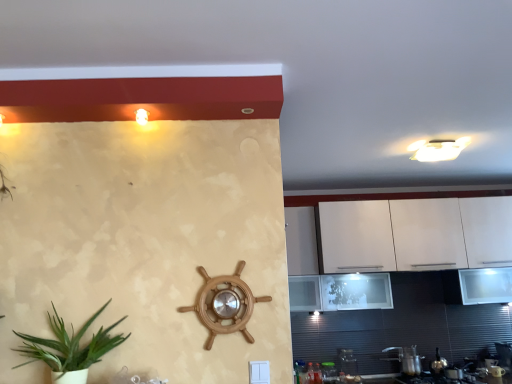
The image size is (512, 384). What do you see at coordinates (504, 354) in the screenshot?
I see `metallic silver kettle at lower right, the first appliance viewed from the right` at bounding box center [504, 354].

Locate an element on the screen. white glossy cabinet at right is located at coordinates (404, 325).

Measure the distance between point (360, 353) and camera.

The depth of point (360, 353) is 3.82 meters.

The height and width of the screenshot is (384, 512). I want to click on metallic silver pot at lower right, which is the second appliance from left to right, so click(x=406, y=359).

Find the location of `metallic silver gas stove at lower right`. metallic silver gas stove at lower right is located at coordinates (438, 378).

I want to click on transparent glass jar at lower right, the third appliance when ordered from right to left, so coord(348,363).

Locate an element on the screen. metallic silver kettle at lower right, which is the third appliance in left-to-right order is located at coordinates (504, 354).

Does metallic silver gas stove at lower right turn towards transparent glass jar at lower right, which is the 1th appliance in left-to-right order?

No, metallic silver gas stove at lower right does not turn towards transparent glass jar at lower right, which is the 1th appliance in left-to-right order.

In terms of size, does metallic silver gas stove at lower right appear bigger or smaller than transparent glass jar at lower right, which is the 1th appliance in left-to-right order?

Considering their sizes, metallic silver gas stove at lower right takes up more space than transparent glass jar at lower right, which is the 1th appliance in left-to-right order.

Is the depth of metallic silver gas stove at lower right less than that of transparent glass jar at lower right, the third appliance when ordered from right to left?

Yes, the depth of metallic silver gas stove at lower right is less than that of transparent glass jar at lower right, the third appliance when ordered from right to left.

Does metallic silver gas stove at lower right have a lesser width compared to transparent glass jar at lower right, which is the 1th appliance in left-to-right order?

Incorrect, the width of metallic silver gas stove at lower right is not less than that of transparent glass jar at lower right, which is the 1th appliance in left-to-right order.

What's the angular difference between matte white light fixture at upper left and transparent glass jar at lower right, which is the 1th appliance in left-to-right order,'s facing directions?

A: 1.67 degrees.

Would you consider matte white light fixture at upper left to be distant from transparent glass jar at lower right, the third appliance when ordered from right to left?

Yes, matte white light fixture at upper left is far from transparent glass jar at lower right, the third appliance when ordered from right to left.

Is matte white light fixture at upper left oriented towards transparent glass jar at lower right, which is the 1th appliance in left-to-right order?

No, matte white light fixture at upper left is not aimed at transparent glass jar at lower right, which is the 1th appliance in left-to-right order.

Is metallic silver gas stove at lower right positioned with its back to green leafy plant in pot at lower left?

No.

Which object is wider, metallic silver gas stove at lower right or green leafy plant in pot at lower left?

Wider between the two is metallic silver gas stove at lower right.

Which of these two, metallic silver gas stove at lower right or green leafy plant in pot at lower left, is bigger?

green leafy plant in pot at lower left.

Is metallic silver pot at lower right, which is the second appliance from right to left, not near green leafy plant in pot at lower left?

Yes, metallic silver pot at lower right, which is the second appliance from right to left, is far from green leafy plant in pot at lower left.

Find the location of a particular element. houseplant that appears in front of the metallic silver pot at lower right, which is the second appliance from left to right is located at coordinates (69, 348).

Can green leafy plant in pot at lower left be found inside metallic silver pot at lower right, which is the second appliance from left to right?

Definitely not — green leafy plant in pot at lower left is not inside metallic silver pot at lower right, which is the second appliance from left to right.

Which is in front, metallic silver pot at lower right, which is the second appliance from left to right, or green leafy plant in pot at lower left?

green leafy plant in pot at lower left is more forward.

Is white glossy cabinet at right positioned in front of metallic silver kettle at lower right, the first appliance viewed from the right?

Yes, it is in front of metallic silver kettle at lower right, the first appliance viewed from the right.

Is white glossy cabinet at right to the left or to the right of metallic silver kettle at lower right, the first appliance viewed from the right, in the image?

In the image, white glossy cabinet at right appears on the left side of metallic silver kettle at lower right, the first appliance viewed from the right.

Does white glossy cabinet at right have a lesser width compared to metallic silver kettle at lower right, which is the third appliance in left-to-right order?

No, white glossy cabinet at right is not thinner than metallic silver kettle at lower right, which is the third appliance in left-to-right order.

Based on the photo, is metallic silver kettle at lower right, which is the third appliance in left-to-right order, surrounded by white glossy cabinet at right?

Definitely not — metallic silver kettle at lower right, which is the third appliance in left-to-right order, is not inside white glossy cabinet at right.

Which is behind, metallic silver kettle at lower right, the first appliance viewed from the right, or green leafy plant in pot at lower left?

metallic silver kettle at lower right, the first appliance viewed from the right, is further from the camera.

From the image's perspective, is metallic silver kettle at lower right, which is the third appliance in left-to-right order, positioned above or below green leafy plant in pot at lower left?

Clearly, from the image's perspective, metallic silver kettle at lower right, which is the third appliance in left-to-right order, is below green leafy plant in pot at lower left.

From a real-world perspective, is metallic silver kettle at lower right, which is the third appliance in left-to-right order, above or below green leafy plant in pot at lower left?

From a real-world perspective, metallic silver kettle at lower right, which is the third appliance in left-to-right order, is physically below green leafy plant in pot at lower left.

From a real-world perspective, starting from the green leafy plant in pot at lower left, which appliance is the 3rd one below it? Please provide its 2D coordinates.

[(504, 354)]

Does green leafy plant in pot at lower left have a lesser width compared to transparent glass jar at lower right, the third appliance when ordered from right to left?

Incorrect, the width of green leafy plant in pot at lower left is not less than that of transparent glass jar at lower right, the third appliance when ordered from right to left.

Considering the positions of points (45, 357) and (343, 357), is point (45, 357) farther from camera compared to point (343, 357)?

No, it is not.

Measure the distance from green leafy plant in pot at lower left to transparent glass jar at lower right, the third appliance when ordered from right to left.

green leafy plant in pot at lower left is 8.90 feet from transparent glass jar at lower right, the third appliance when ordered from right to left.

From the image's perspective, starting from the metallic silver gas stove at lower right, which appliance is the 1st one above? Please provide its 2D coordinates.

[(348, 363)]

In order to click on light fixture on the left of transparent glass jar at lower right, which is the 1th appliance in left-to-right order in this screenshot , I will do `click(142, 116)`.

Looking at this image, which object lies further to the anchor point metallic silver kettle at lower right, the first appliance viewed from the right, metallic silver gas stove at lower right or white glossy cabinet at right?

white glossy cabinet at right.

When comparing their distances from metallic silver pot at lower right, which is the second appliance from right to left, does green leafy plant in pot at lower left or metallic silver kettle at lower right, the first appliance viewed from the right, seem further?

Based on the image, green leafy plant in pot at lower left appears to be further to metallic silver pot at lower right, which is the second appliance from right to left.

Looking at the image, which one is located closer to metallic silver pot at lower right, which is the second appliance from right to left, transparent glass jar at lower right, the third appliance when ordered from right to left, or metallic silver kettle at lower right, the first appliance viewed from the right?

The object closer to metallic silver pot at lower right, which is the second appliance from right to left, is transparent glass jar at lower right, the third appliance when ordered from right to left.

Estimate the real-world distances between objects in this image. Which object is closer to white glossy cabinet at right, green leafy plant in pot at lower left or matte white light fixture at upper left?

green leafy plant in pot at lower left.

Estimate the real-world distances between objects in this image. Which object is closer to white glossy cabinet at right, green leafy plant in pot at lower left or transparent glass jar at lower right, which is the 1th appliance in left-to-right order?

transparent glass jar at lower right, which is the 1th appliance in left-to-right order, lies closer to white glossy cabinet at right than the other object.

When comparing their distances from metallic silver gas stove at lower right, does green leafy plant in pot at lower left or white glossy cabinet at right seem further?

Among the two, green leafy plant in pot at lower left is located further to metallic silver gas stove at lower right.

Which object lies nearer to the anchor point white glossy cabinet at right, matte white light fixture at upper left or transparent glass jar at lower right, the third appliance when ordered from right to left?

transparent glass jar at lower right, the third appliance when ordered from right to left.

In the scene shown: From the image, which object appears to be farther from transparent glass jar at lower right, which is the 1th appliance in left-to-right order, metallic silver kettle at lower right, the first appliance viewed from the right, or matte white light fixture at upper left?

matte white light fixture at upper left lies further to transparent glass jar at lower right, which is the 1th appliance in left-to-right order, than the other object.

Locate an element on the screen. The image size is (512, 384). dresser located between transparent glass jar at lower right, the third appliance when ordered from right to left, and metallic silver kettle at lower right, which is the third appliance in left-to-right order, in the left-right direction is located at coordinates (404, 325).

Locate an element on the screen. The height and width of the screenshot is (384, 512). dresser between matte white light fixture at upper left and metallic silver gas stove at lower right in the horizontal direction is located at coordinates (404, 325).

Identify the location of gas stove situated between transparent glass jar at lower right, which is the 1th appliance in left-to-right order, and metallic silver kettle at lower right, which is the third appliance in left-to-right order, from left to right. (438, 378).

Locate an element on the screen. gas stove between green leafy plant in pot at lower left and metallic silver kettle at lower right, the first appliance viewed from the right, in the horizontal direction is located at coordinates (438, 378).